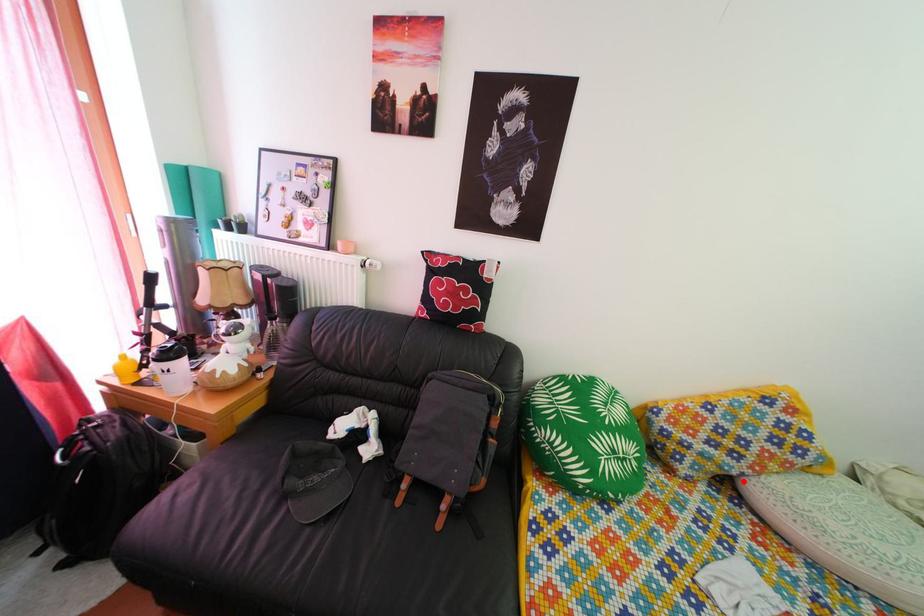
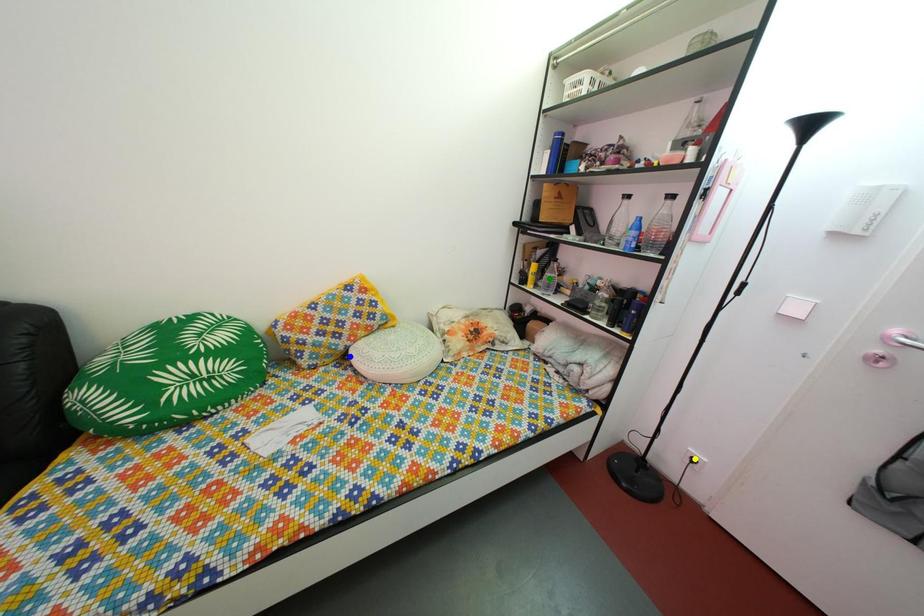
Question: I am providing you with two images of the same scene from different viewpoints. A red point is marked on the first image. You are given multiple points on the second image. Which point in image 2 represents the same 3d spot as the red point in image 1?

Choices:
 (A) green point
 (B) yellow point
 (C) blue point

Answer: (C)